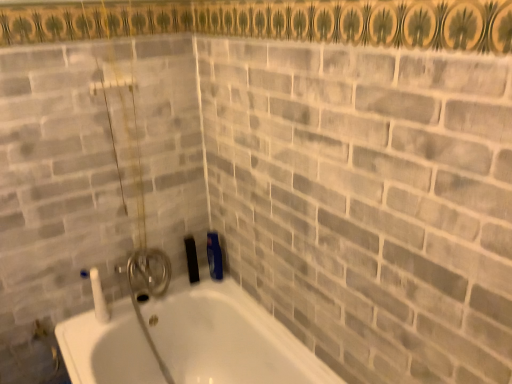
Question: Is gray brick at upper center not close to white glossy bathtub at lower left?

Choices:
 (A) yes
 (B) no

Answer: (B)

Question: Can you confirm if gray brick at upper center is thinner than white glossy bathtub at lower left?

Choices:
 (A) no
 (B) yes

Answer: (A)

Question: Is gray brick at upper center facing towards white glossy bathtub at lower left?

Choices:
 (A) no
 (B) yes

Answer: (A)

Question: Is gray brick at upper center outside white glossy bathtub at lower left?

Choices:
 (A) no
 (B) yes

Answer: (B)

Question: Considering the relative sizes of gray brick at upper center and white glossy bathtub at lower left in the image provided, is gray brick at upper center taller than white glossy bathtub at lower left?

Choices:
 (A) no
 (B) yes

Answer: (B)

Question: Considering the relative sizes of gray brick at upper center and white glossy bathtub at lower left in the image provided, is gray brick at upper center shorter than white glossy bathtub at lower left?

Choices:
 (A) yes
 (B) no

Answer: (B)

Question: Considering the relative sizes of white glossy bathtub at lower left and gray brick at upper center in the image provided, is white glossy bathtub at lower left thinner than gray brick at upper center?

Choices:
 (A) yes
 (B) no

Answer: (A)

Question: From the image's perspective, is white glossy bathtub at lower left located above gray brick at upper center?

Choices:
 (A) yes
 (B) no

Answer: (B)

Question: Is the position of white glossy bathtub at lower left more distant than that of gray brick at upper center?

Choices:
 (A) no
 (B) yes

Answer: (B)

Question: Does white glossy bathtub at lower left appear on the left side of gray brick at upper center?

Choices:
 (A) yes
 (B) no

Answer: (A)

Question: Is there a large distance between white glossy bathtub at lower left and gray brick at upper center?

Choices:
 (A) no
 (B) yes

Answer: (A)

Question: Is white glossy bathtub at lower left in contact with gray brick at upper center?

Choices:
 (A) yes
 (B) no

Answer: (B)

Question: Is white glossy bathtub at lower left taller or shorter than gray brick at upper center?

Choices:
 (A) tall
 (B) short

Answer: (B)